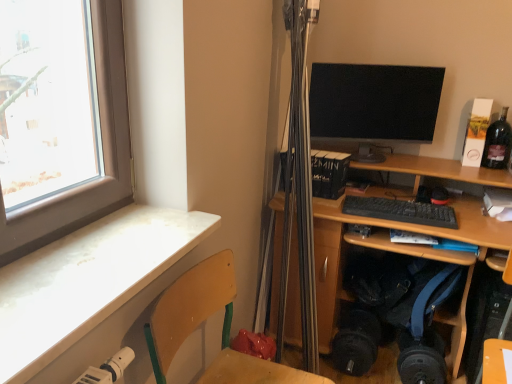
Question: Does point (108, 215) appear closer or farther from the camera than point (368, 66)?

Choices:
 (A) farther
 (B) closer

Answer: (B)

Question: From the image's perspective, is white marble desk at lower left, acting as the 1th desk starting from the left, located above or below matte black monitor at upper right?

Choices:
 (A) above
 (B) below

Answer: (B)

Question: Which is farther from the dark glass bottle at upper right?

Choices:
 (A) wooden at left
 (B) black matte keyboard at center
 (C) white marble desk at lower left, arranged as the second desk when viewed from the back
 (D) wooden desk at center, marked as the first desk in a back-to-front arrangement
 (E) matte black monitor at upper right

Answer: (C)

Question: Estimate the real-world distances between objects in this image. Which object is closer to the matte black monitor at upper right?

Choices:
 (A) wooden desk at center, marked as the first desk in a back-to-front arrangement
 (B) white marble desk at lower left, acting as the 1th desk starting from the left
 (C) dark glass bottle at upper right
 (D) wooden at left
 (E) black matte keyboard at center

Answer: (A)